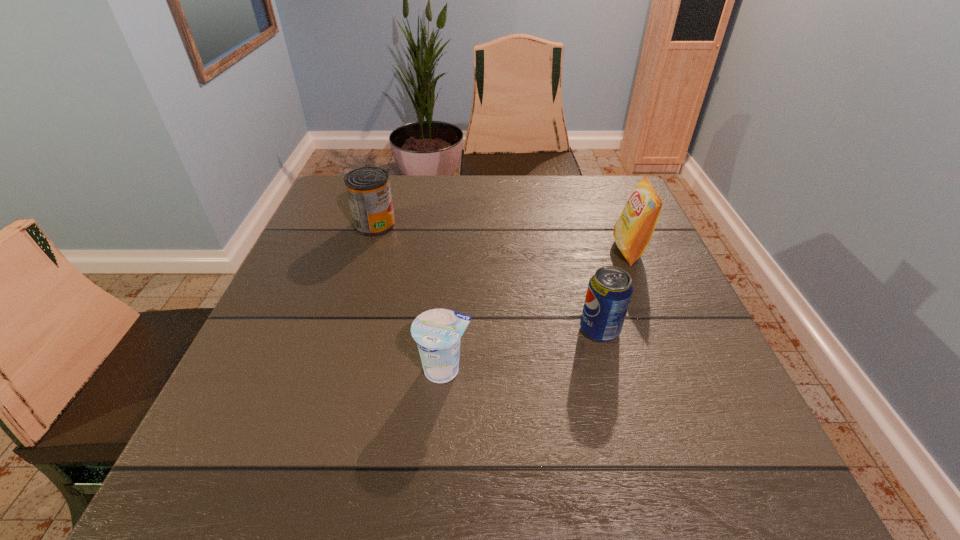
What are the coordinates of `free space between the soda and the yogurt` in the screenshot? It's located at (522, 350).

Identify which object is located as the nearest to the nearest object. Please provide its 2D coordinates. Your answer should be formatted as a tuple, i.e. [(x, y)], where the tuple contains the x and y coordinates of a point satisfying the conditions above.

[(610, 289)]

The image size is (960, 540). Identify the location of object that stands as the second closest to the crisp (potato chip). coord(438,332).

This screenshot has height=540, width=960. Find the location of `blank space that satisfies the following two spatial constraints: 1. on the front side of the can; 2. on the right side of the third farthest object`. blank space that satisfies the following two spatial constraints: 1. on the front side of the can; 2. on the right side of the third farthest object is located at coordinates (342, 330).